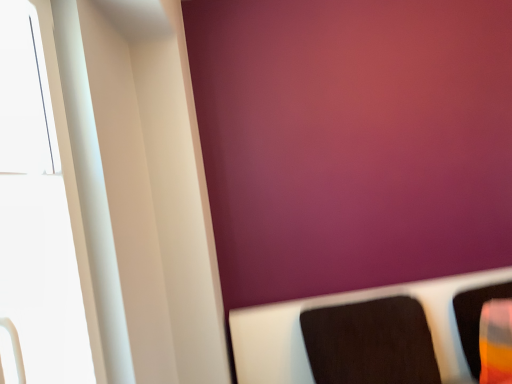
Question: Is white glossy window at left aimed at translucent plastic cup at right, the 1th furniture when ordered from right to left?

Choices:
 (A) no
 (B) yes

Answer: (A)

Question: Is white glossy window at left outside of translucent plastic cup at right, the 1th furniture when ordered from right to left?

Choices:
 (A) no
 (B) yes

Answer: (B)

Question: Considering the relative sizes of white glossy window at left and translucent plastic cup at right, the 1th furniture when ordered from right to left, in the image provided, is white glossy window at left bigger than translucent plastic cup at right, the 1th furniture when ordered from right to left,?

Choices:
 (A) no
 (B) yes

Answer: (B)

Question: Can you confirm if white glossy window at left is taller than translucent plastic cup at right, the 1th furniture when ordered from right to left?

Choices:
 (A) yes
 (B) no

Answer: (A)

Question: Can you confirm if white glossy window at left is wider than translucent plastic cup at right, the 1th furniture when ordered from right to left?

Choices:
 (A) yes
 (B) no

Answer: (A)

Question: In terms of width, does translucent plastic cup at right, the 1th furniture when ordered from right to left, look wider or thinner when compared to black fabric cushion at lower right, which appears as the first furniture when viewed from the left?

Choices:
 (A) thin
 (B) wide

Answer: (A)

Question: Is point (461, 337) closer or farther from the camera than point (411, 349)?

Choices:
 (A) closer
 (B) farther

Answer: (B)

Question: From the image's perspective, is translucent plastic cup at right, the 1th furniture when ordered from right to left, located above or below black fabric cushion at lower right, placed as the 2th furniture when sorted from right to left?

Choices:
 (A) above
 (B) below

Answer: (A)

Question: Is translucent plastic cup at right, the 1th furniture when ordered from right to left, taller or shorter than black fabric cushion at lower right, placed as the 2th furniture when sorted from right to left?

Choices:
 (A) tall
 (B) short

Answer: (B)

Question: Considering the positions of white glossy window at left and black fabric cushion at lower right, placed as the 2th furniture when sorted from right to left, in the image, is white glossy window at left wider or thinner than black fabric cushion at lower right, placed as the 2th furniture when sorted from right to left,?

Choices:
 (A) thin
 (B) wide

Answer: (A)

Question: Is white glossy window at left to the left or to the right of black fabric cushion at lower right, which appears as the first furniture when viewed from the left, in the image?

Choices:
 (A) left
 (B) right

Answer: (A)

Question: Is white glossy window at left inside the boundaries of black fabric cushion at lower right, placed as the 2th furniture when sorted from right to left, or outside?

Choices:
 (A) outside
 (B) inside

Answer: (A)

Question: From a real-world perspective, is white glossy window at left physically located above or below black fabric cushion at lower right, placed as the 2th furniture when sorted from right to left?

Choices:
 (A) above
 (B) below

Answer: (A)

Question: Considering the positions of black fabric cushion at lower right, which appears as the first furniture when viewed from the left, and translucent plastic cup at right, which is the second furniture in left-to-right order, in the image, is black fabric cushion at lower right, which appears as the first furniture when viewed from the left, bigger or smaller than translucent plastic cup at right, which is the second furniture in left-to-right order,?

Choices:
 (A) big
 (B) small

Answer: (A)

Question: From a real-world perspective, is black fabric cushion at lower right, which appears as the first furniture when viewed from the left, above or below translucent plastic cup at right, the 1th furniture when ordered from right to left?

Choices:
 (A) below
 (B) above

Answer: (B)